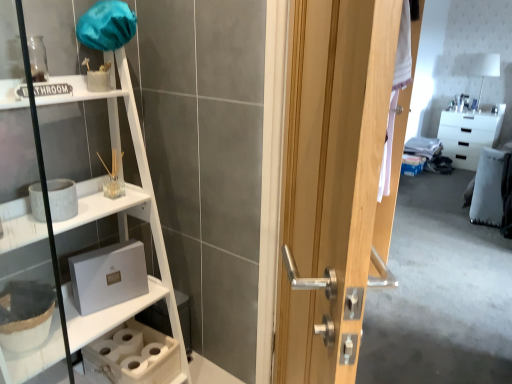
Question: Is white wood shelf at left inside the boundaries of wooden door at center, or outside?

Choices:
 (A) outside
 (B) inside

Answer: (A)

Question: From their relative heights in the image, would you say white wood shelf at left is taller or shorter than wooden door at center?

Choices:
 (A) short
 (B) tall

Answer: (B)

Question: Based on their relative distances, which object is nearer to the white wood shelf at left?

Choices:
 (A) wooden door at center
 (B) white glossy cabinet at upper right

Answer: (A)

Question: Considering the real-world distances, which object is closest to the wooden door at center?

Choices:
 (A) white wood shelf at left
 (B) white glossy cabinet at upper right

Answer: (A)